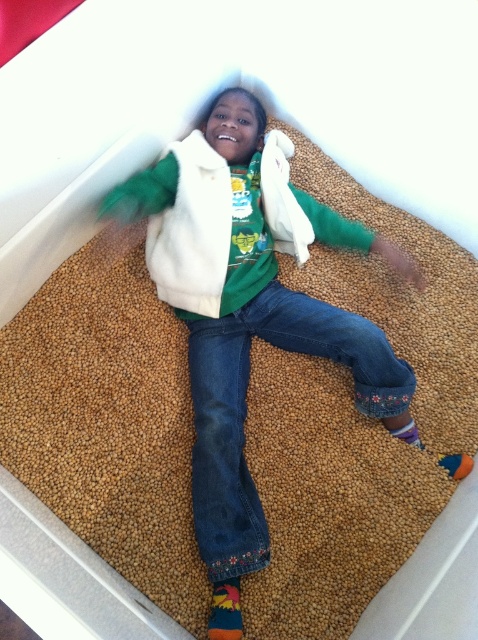
Question: Is white fleece jacket at center smaller than denim at center?

Choices:
 (A) no
 (B) yes

Answer: (A)

Question: Is white fleece jacket at center behind denim at center?

Choices:
 (A) no
 (B) yes

Answer: (A)

Question: Which of the following is the closest to the observer?

Choices:
 (A) white fleece jacket at center
 (B) denim at center

Answer: (A)

Question: From the image, what is the correct spatial relationship of white fleece jacket at center in relation to denim at center?

Choices:
 (A) above
 (B) below

Answer: (A)

Question: Which point appears farthest from the camera in this image?

Choices:
 (A) (227, 349)
 (B) (239, 456)

Answer: (A)

Question: Which point is farther to the camera?

Choices:
 (A) white fleece jacket at center
 (B) denim at center

Answer: (B)